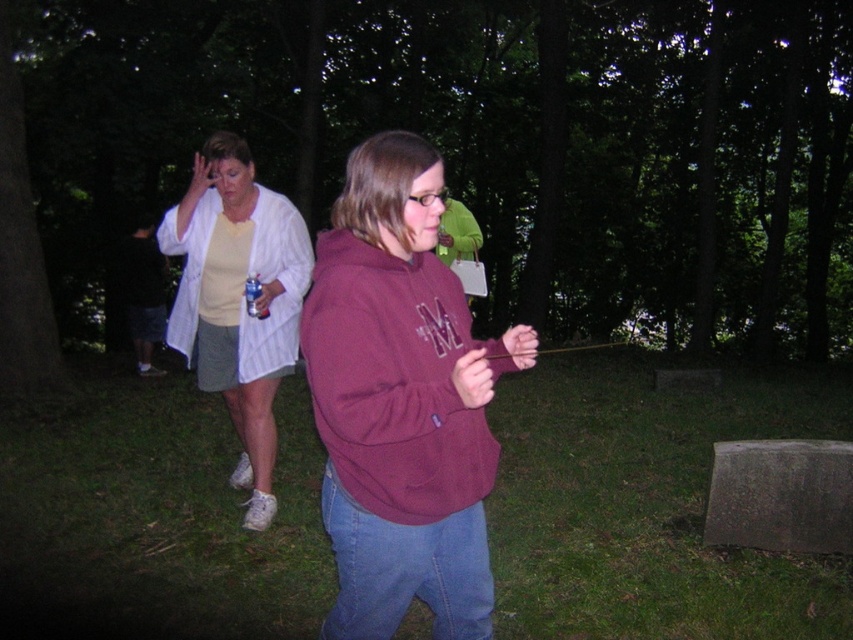
Question: Which object is the farthest from the light beige striped shirt at left?

Choices:
 (A) maroon hoodie at center
 (B) dark gray shorts at left

Answer: (B)

Question: Does maroon hoodie at center appear over light beige striped shirt at left?

Choices:
 (A) no
 (B) yes

Answer: (A)

Question: Is light beige striped shirt at left further to camera compared to dark gray shorts at left?

Choices:
 (A) yes
 (B) no

Answer: (B)

Question: Considering the relative positions of light beige striped shirt at left and dark gray shorts at left in the image provided, where is light beige striped shirt at left located with respect to dark gray shorts at left?

Choices:
 (A) right
 (B) left

Answer: (A)

Question: Estimate the real-world distances between objects in this image. Which object is closer to the maroon hoodie at center?

Choices:
 (A) light beige striped shirt at left
 (B) dark gray shorts at left

Answer: (A)

Question: Which point appears closest to the camera in this image?

Choices:
 (A) (126, 310)
 (B) (285, 362)

Answer: (B)